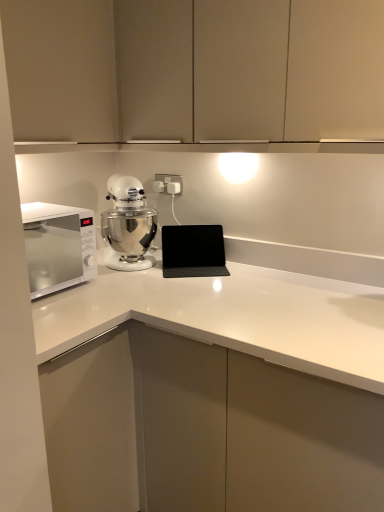
Question: Is white glossy microwave at left positioned behind matte beige cabinets at upper center, the 1th cabinetry positioned from the right?

Choices:
 (A) yes
 (B) no

Answer: (A)

Question: Considering the relative sizes of white glossy microwave at left and matte beige cabinets at upper center, the 1th cabinetry positioned from the right, in the image provided, is white glossy microwave at left smaller than matte beige cabinets at upper center, the 1th cabinetry positioned from the right,?

Choices:
 (A) no
 (B) yes

Answer: (B)

Question: Is white glossy microwave at left wider than matte beige cabinets at upper center, the 1th cabinetry positioned from the right?

Choices:
 (A) no
 (B) yes

Answer: (B)

Question: Does white glossy microwave at left contain matte beige cabinets at upper center, arranged as the second cabinetry when viewed from the left?

Choices:
 (A) no
 (B) yes

Answer: (A)

Question: Does white glossy microwave at left appear on the left side of matte beige cabinets at upper center, arranged as the second cabinetry when viewed from the left?

Choices:
 (A) no
 (B) yes

Answer: (B)

Question: From a real-world perspective, relative to silver metallic mixer at center, is black matte laptop at center vertically above or below?

Choices:
 (A) below
 (B) above

Answer: (A)

Question: Considering the positions of point (185, 247) and point (112, 234), is point (185, 247) closer or farther from the camera than point (112, 234)?

Choices:
 (A) closer
 (B) farther

Answer: (A)

Question: Visually, is black matte laptop at center positioned to the left or to the right of silver metallic mixer at center?

Choices:
 (A) right
 (B) left

Answer: (A)

Question: Is black matte laptop at center in front of or behind silver metallic mixer at center in the image?

Choices:
 (A) front
 (B) behind

Answer: (B)

Question: In terms of width, does silver metallic mixer at center look wider or thinner when compared to matte beige cabinet at upper left, which is counted as the first cabinetry, starting from the left?

Choices:
 (A) thin
 (B) wide

Answer: (A)

Question: Is silver metallic mixer at center taller or shorter than matte beige cabinet at upper left, acting as the 2th cabinetry starting from the right?

Choices:
 (A) tall
 (B) short

Answer: (B)

Question: From the image's perspective, is silver metallic mixer at center positioned above or below matte beige cabinet at upper left, which is counted as the first cabinetry, starting from the left?

Choices:
 (A) above
 (B) below

Answer: (B)

Question: Is silver metallic mixer at center to the left or to the right of matte beige cabinet at upper left, which is counted as the first cabinetry, starting from the left, in the image?

Choices:
 (A) left
 (B) right

Answer: (B)

Question: From the image's perspective, is black matte laptop at center located above or below matte beige cabinet at upper left, which is counted as the first cabinetry, starting from the left?

Choices:
 (A) below
 (B) above

Answer: (A)

Question: Based on their sizes in the image, would you say black matte laptop at center is bigger or smaller than matte beige cabinet at upper left, acting as the 2th cabinetry starting from the right?

Choices:
 (A) small
 (B) big

Answer: (A)